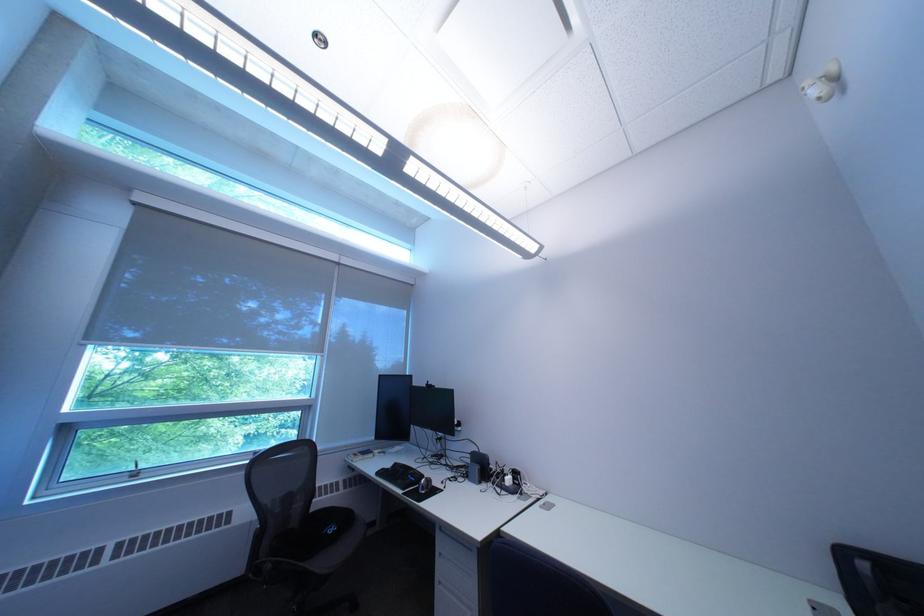
In order to click on chair armrest in this screenshot , I will do `click(332, 552)`.